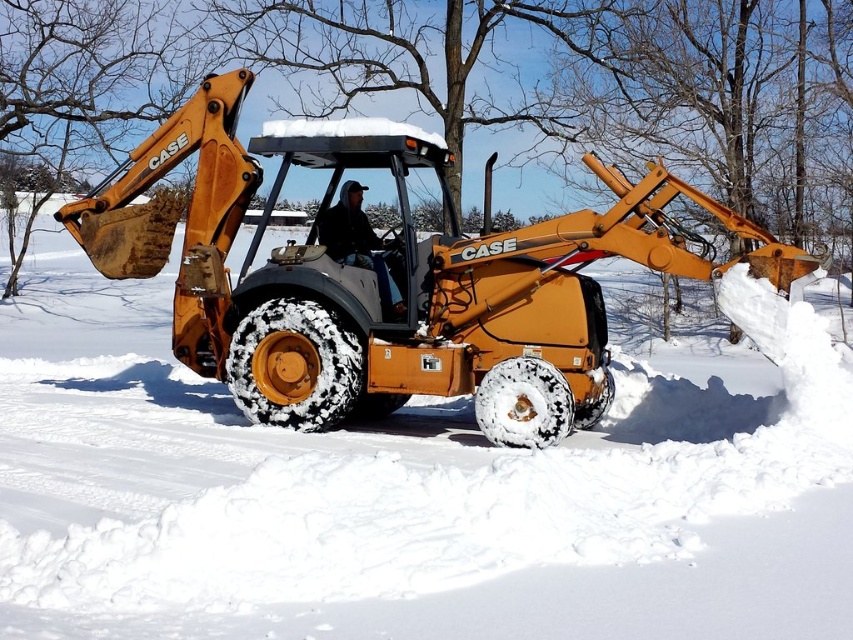
You are a safety inspector checking the placement of equipment and personnel in the image. The matte yellow tractor at center and the dark blue jeans at center are both present. According to safety regulations, the minimum distance between the tractor and any personnel should be 2 meters. Can you determine if the current placement complies with this requirement based on their widths?

The matte yellow tractor at center has a lesser width compared to dark blue jeans at center. However, the provided information only specifies their widths relative to each other, not the actual distance between them. Without knowing the exact distance between the two, it is impossible to confirm compliance with the 2 meter safety regulation.